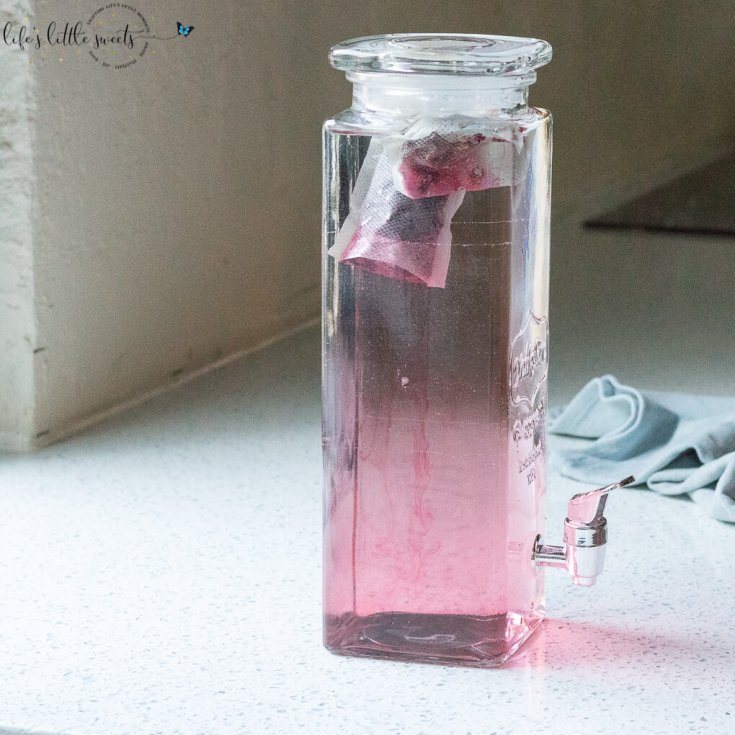
The height and width of the screenshot is (735, 735). In order to click on beige wall in this screenshot , I will do `click(247, 162)`.